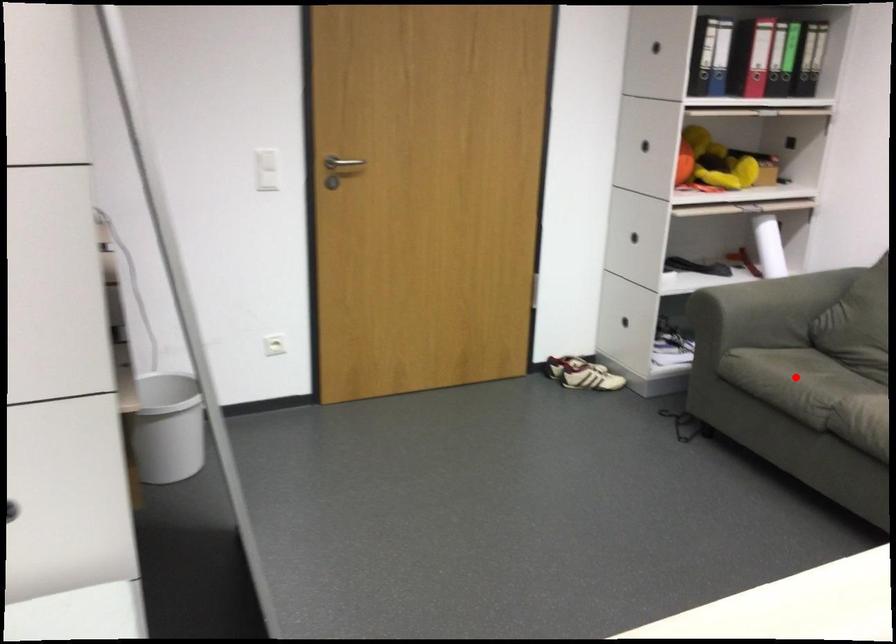
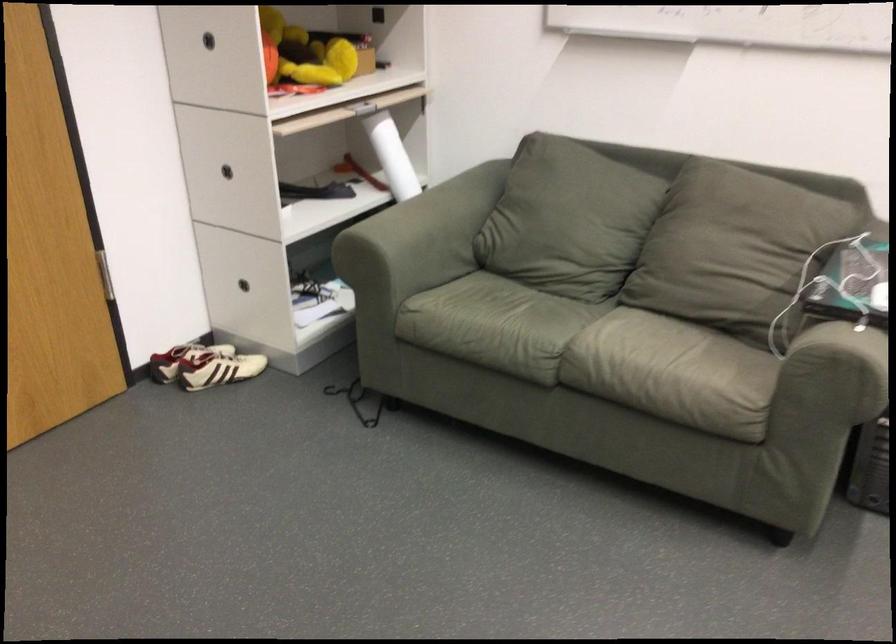
Where in the second image is the point corresponding to the highlighted location from the first image?

(495, 325)